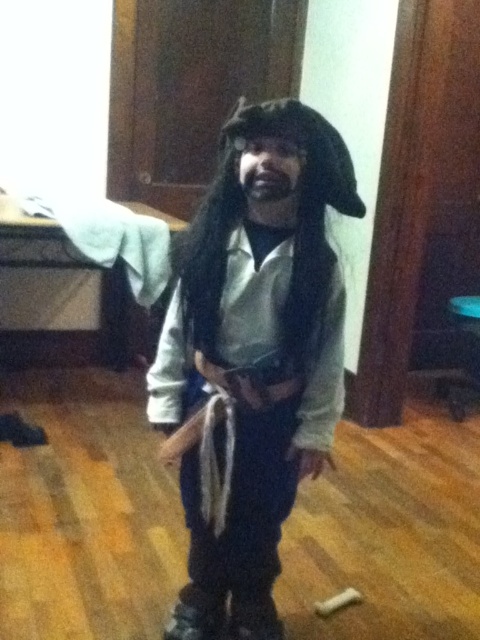
You are a photographer setting up a shoot in this room. You need to ensure that the white matte pirate costume at center and the dark brown hair at center are both visible in the frame. Given that the costume is closer to you, how should you position your camera to capture both objects clearly?

Since the white matte pirate costume at center is closer to you than the dark brown hair at center, position the camera so it focuses on the costume first. This way, both the costume and the hair will be in the frame, with the costume in the foreground and the hair slightly behind it.

You are a photographer setting up for a pirate costume photoshoot. You have two markers at coordinates point (319,352) and point (267,202). You need to place a prop behind the pirate so it doesn

Point 0.550, 0665 is behind point (267,202), so placing the prop at point (319,352) would place it behind the pirate.